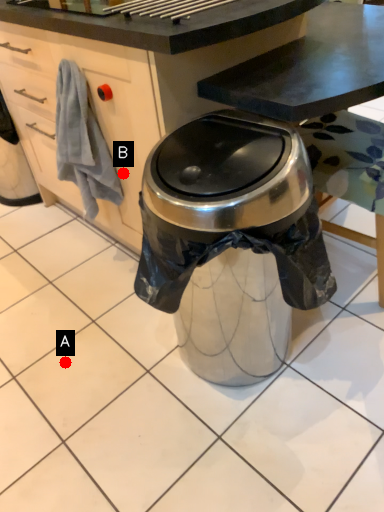
Question: Two points are circled on the image, labeled by A and B beside each circle. Which point is closer to the camera taking this photo?

Choices:
 (A) A is closer
 (B) B is closer

Answer: (B)